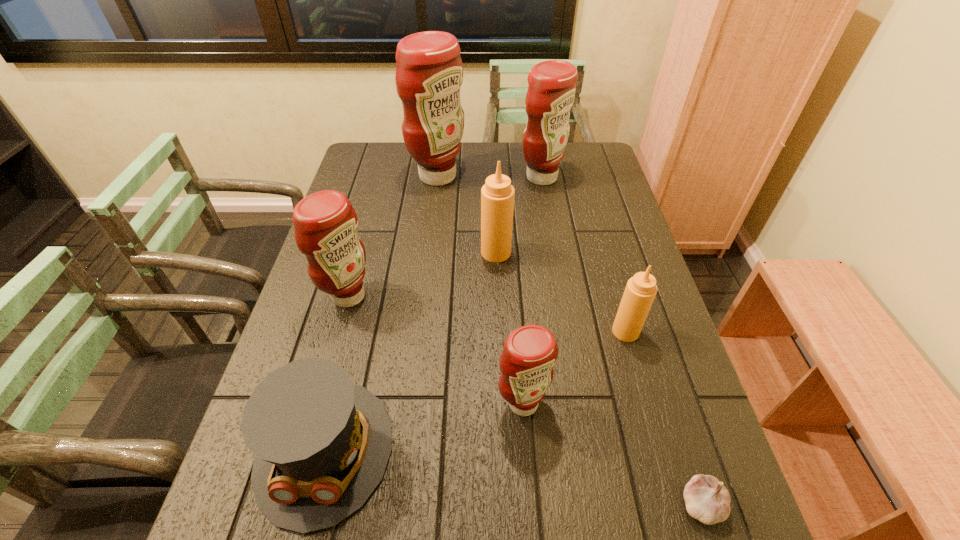
You are a GUI agent. You are given a task and a screenshot of the screen. Output one action in this format:
    pyautogui.click(x=<x>, y=<y>)
    Task: Click on the second red condiment from left to right
    
    Given the screenshot: What is the action you would take?
    pyautogui.click(x=429, y=73)

Find the location of a particular element. Image resolution: width=960 pixels, height=540 pixels. the biggest red condiment is located at coordinates (429, 73).

At what (x,y) coordinates should I click in order to perform the action: click on the seventh shortest object. Please return your answer as a coordinate pair (x, y). The height and width of the screenshot is (540, 960). Looking at the image, I should click on (551, 92).

The width and height of the screenshot is (960, 540). I want to click on the second biggest red condiment, so click(551, 92).

Identify the location of the bigger tan condiment. Image resolution: width=960 pixels, height=540 pixels. (497, 195).

Where is `the farther tan condiment`? The width and height of the screenshot is (960, 540). the farther tan condiment is located at coordinates (497, 195).

Locate an element on the screen. the third biggest red condiment is located at coordinates (325, 222).

I want to click on the leftmost red condiment, so click(325, 222).

Where is `the smallest red condiment`? the smallest red condiment is located at coordinates (530, 352).

Where is `the nearest condiment`? The image size is (960, 540). the nearest condiment is located at coordinates (530, 352).